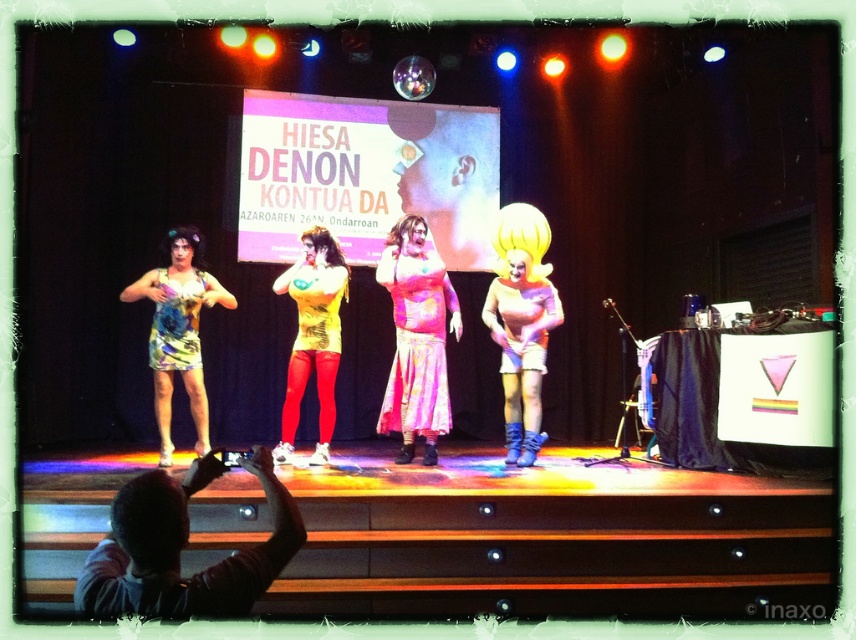
Question: Which point is farther to the camera?

Choices:
 (A) floral fabric dress at left
 (B) floral chiffon dress at center
 (C) dark blue fabric at lower left
 (D) floral dress at left

Answer: (B)

Question: Can you confirm if floral dress at left is wider than yellow fabric dress at center?

Choices:
 (A) no
 (B) yes

Answer: (B)

Question: Does floral chiffon dress at center appear under floral fabric dress at left?

Choices:
 (A) no
 (B) yes

Answer: (B)

Question: Which point is farther from the camera taking this photo?

Choices:
 (A) [x=198, y=593]
 (B) [x=179, y=232]
 (C) [x=428, y=259]

Answer: (C)

Question: Estimate the real-world distances between objects in this image. Which object is farther from the floral dress at left?

Choices:
 (A) dark blue fabric at lower left
 (B) floral fabric dress at left
 (C) yellow fabric dress at center

Answer: (A)

Question: Considering the relative positions of dark blue fabric at lower left and floral dress at left in the image provided, where is dark blue fabric at lower left located with respect to floral dress at left?

Choices:
 (A) below
 (B) above

Answer: (A)